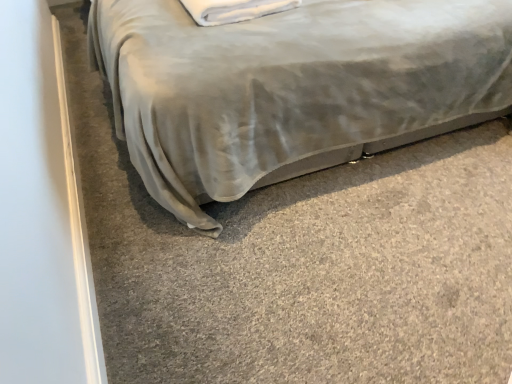
Find the location of `satin gray bed at center`. satin gray bed at center is located at coordinates (291, 88).

Describe the element at coordinates (291, 88) in the screenshot. I see `satin gray bed at center` at that location.

Find the location of a particular element. white soft pillow at upper center is located at coordinates (234, 10).

Measure the distance between white soft pillow at upper center and camera.

They are 4.70 feet apart.

Describe the element at coordinates (234, 10) in the screenshot. I see `white soft pillow at upper center` at that location.

Where is `satin gray bed at center`? satin gray bed at center is located at coordinates (291, 88).

Considering the relative positions of satin gray bed at center and white soft pillow at upper center in the image provided, is satin gray bed at center to the left or to the right of white soft pillow at upper center?

Based on their positions, satin gray bed at center is located to the right of white soft pillow at upper center.

Is the position of satin gray bed at center more distant than that of white soft pillow at upper center?

No, satin gray bed at center is closer to the viewer.

Does point (194, 223) come in front of point (248, 15)?

Yes, point (194, 223) is closer to viewer.

From the image's perspective, which one is positioned higher, satin gray bed at center or white soft pillow at upper center?

satin gray bed at center, from the image's perspective.

From a real-world perspective, which object rests below the other?

In real-world perspective, satin gray bed at center is lower.

Does satin gray bed at center have a lesser width compared to white soft pillow at upper center?

No, satin gray bed at center is not thinner than white soft pillow at upper center.

Who is shorter, satin gray bed at center or white soft pillow at upper center?

Standing shorter between the two is white soft pillow at upper center.

Considering the relative sizes of satin gray bed at center and white soft pillow at upper center in the image provided, is satin gray bed at center bigger than white soft pillow at upper center?

Indeed, satin gray bed at center has a larger size compared to white soft pillow at upper center.

Is satin gray bed at center located outside white soft pillow at upper center?

satin gray bed at center lies outside white soft pillow at upper center's area.

Based on the photo, can you see satin gray bed at center touching white soft pillow at upper center?

No, satin gray bed at center is not with white soft pillow at upper center.

Is satin gray bed at center turned away from white soft pillow at upper center?

satin gray bed at center is not turned away from white soft pillow at upper center.

In the image, there is a white soft pillow at upper center. Identify the location of bed above it (from the image's perspective). This screenshot has height=384, width=512. (291, 88).

Between white soft pillow at upper center and satin gray bed at center, which one appears on the right side from the viewer's perspective?

satin gray bed at center is more to the right.

Is the position of white soft pillow at upper center less distant than that of satin gray bed at center?

No, white soft pillow at upper center is further to the viewer.

Is point (230, 19) closer to viewer compared to point (228, 91)?

That is False.

From the image's perspective, would you say white soft pillow at upper center is shown under satin gray bed at center?

Yes, from the image's perspective, white soft pillow at upper center is below satin gray bed at center.

From a real-world perspective, is white soft pillow at upper center under satin gray bed at center?

No, from a real-world perspective, white soft pillow at upper center is not beneath satin gray bed at center.

Which object is thinner, white soft pillow at upper center or satin gray bed at center?

Thinner between the two is white soft pillow at upper center.

From their relative heights in the image, would you say white soft pillow at upper center is taller or shorter than satin gray bed at center?

white soft pillow at upper center is shorter than satin gray bed at center.

Based on their sizes in the image, would you say white soft pillow at upper center is bigger or smaller than satin gray bed at center?

Clearly, white soft pillow at upper center is smaller in size than satin gray bed at center.

Is white soft pillow at upper center situated inside satin gray bed at center or outside?

white soft pillow at upper center lies within the bounds of satin gray bed at center.

Is there a large distance between white soft pillow at upper center and satin gray bed at center?

That's not correct — white soft pillow at upper center is a little close to satin gray bed at center.

Is satin gray bed at center at the back of white soft pillow at upper center?

Yes, satin gray bed at center is at the back of white soft pillow at upper center.

In order to click on bed to the right of white soft pillow at upper center in this screenshot , I will do `click(291, 88)`.

Image resolution: width=512 pixels, height=384 pixels. I want to click on bed above the white soft pillow at upper center (from the image's perspective), so [x=291, y=88].

Locate an element on the screen. This screenshot has height=384, width=512. bed on the right side of white soft pillow at upper center is located at coordinates (291, 88).